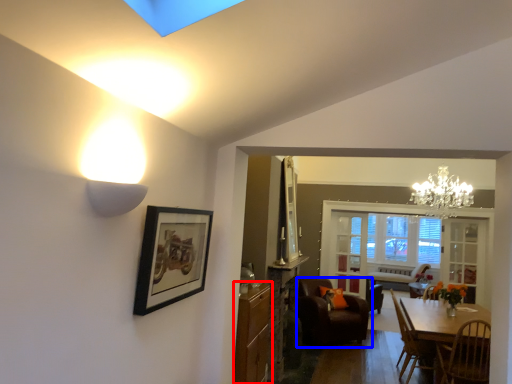
Question: Which of the following is the closest to the observer, cabinetry (highlighted by a red box) or chair (highlighted by a blue box)?

Choices:
 (A) cabinetry
 (B) chair

Answer: (A)